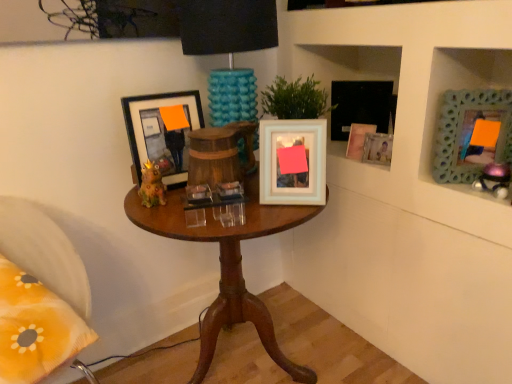
What are the coordinates of `free space in front of matte black picture frame at left, the first picture frame positioned from the left` in the screenshot? It's located at (166, 203).